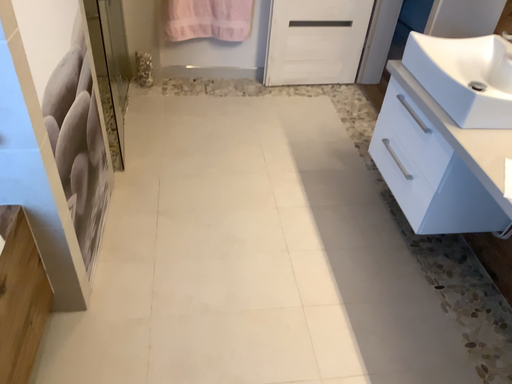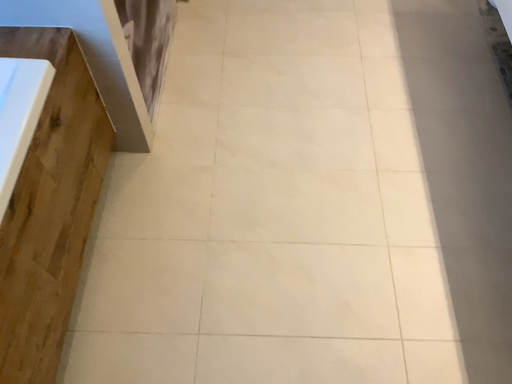
Question: Which way did the camera rotate in the video?

Choices:
 (A) rotated left
 (B) rotated right

Answer: (A)